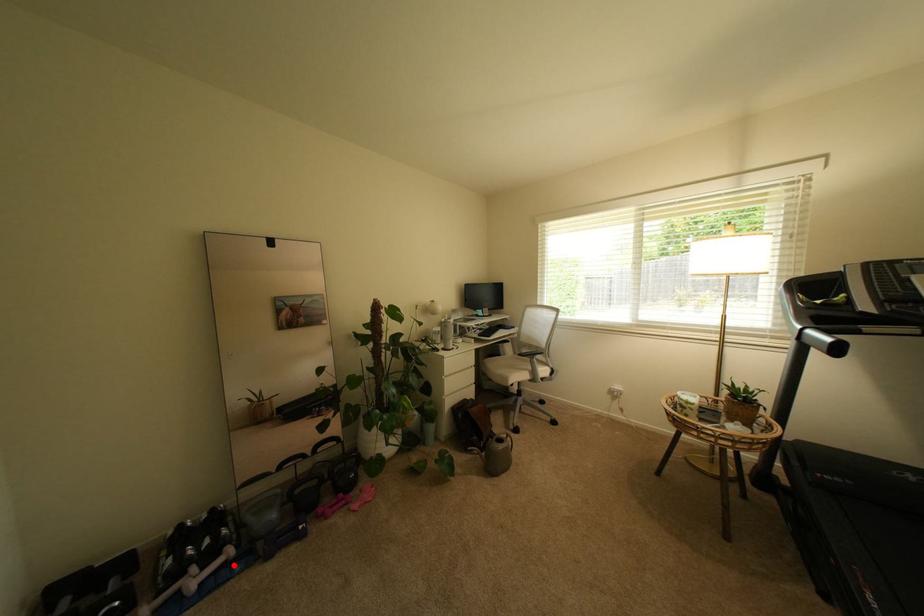
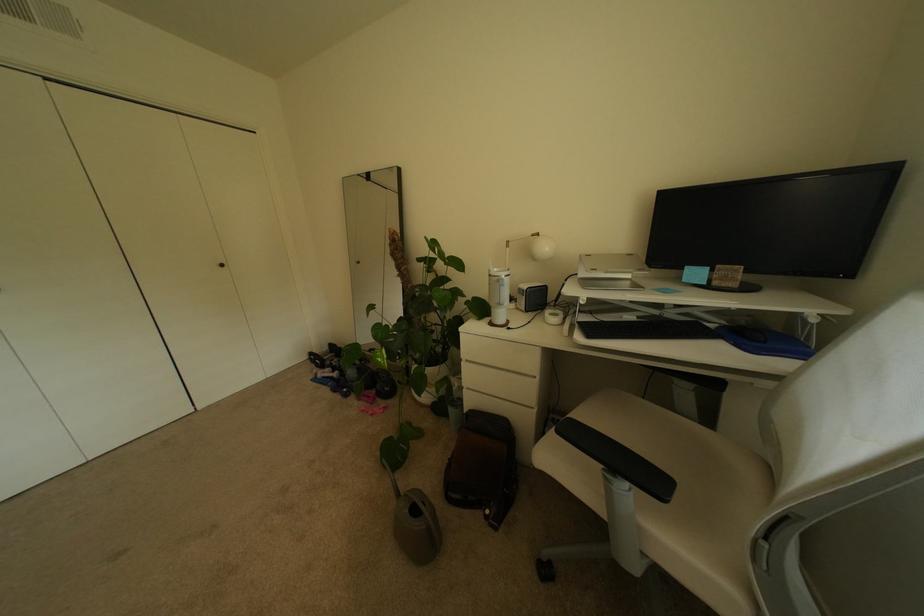
Find the pixel in the second image that matches the highlighted location in the first image.

(341, 379)